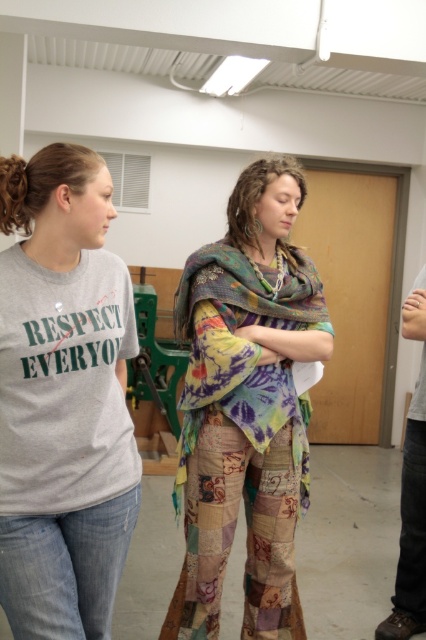
Does gray cotton t-shirt at left appear over textured multicolored shawl at center?

No.

Describe the element at coordinates (63, 397) in the screenshot. Image resolution: width=426 pixels, height=640 pixels. I see `gray cotton t-shirt at left` at that location.

What are the coordinates of `gray cotton t-shirt at left` in the screenshot? It's located at (63, 397).

Who is positioned more to the right, gray cotton t-shirt at left or patchwork fabric scarf at center?

patchwork fabric scarf at center is more to the right.

Does point (20, 275) come closer to viewer compared to point (198, 497)?

Yes, point (20, 275) is closer to viewer.

Is point (54, 525) closer to viewer compared to point (287, 422)?

Yes.

The height and width of the screenshot is (640, 426). I want to click on gray cotton t-shirt at left, so click(63, 397).

Can you confirm if patchwork fabric scarf at center is positioned to the left of textured multicolored shawl at center?

Incorrect, patchwork fabric scarf at center is not on the left side of textured multicolored shawl at center.

Is patchwork fabric scarf at center shorter than textured multicolored shawl at center?

No, patchwork fabric scarf at center is not shorter than textured multicolored shawl at center.

Between point (207, 444) and point (256, 276), which one is positioned behind?

The point (256, 276) is behind.

Identify the location of patchwork fabric scarf at center. The height and width of the screenshot is (640, 426). (245, 406).